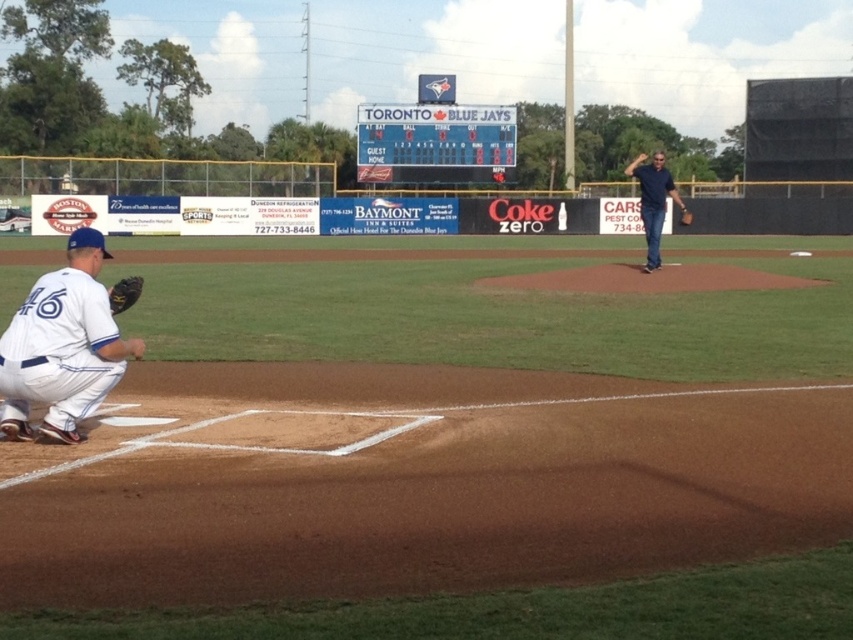
Looking at this image, you are a photographer standing at the edge of the baseball field. You want to take a photo that includes both the white uniform at lower left and the brown leather glove at center. Which object should you zoom in on to ensure both fit in the frame without cropping?

You should zoom in on the brown leather glove at center because the white uniform at lower left is wider than the brown leather glove at center, so focusing on the smaller object allows both to fit in the frame.

You are a photographer at the baseball field and want to take a picture of both the white plastic scoreboard at upper center and the brown leather glove at center. However, the scoreboard is blocking the view of the glove. Can you adjust your camera angle to capture both objects in the frame without any obstruction?

The white plastic scoreboard at upper center is positioned over the brown leather glove at center. To capture both without obstruction, you can lower your camera angle to position the scoreboard above the glove or move to a side angle where the scoreboard doesn not block the glove.